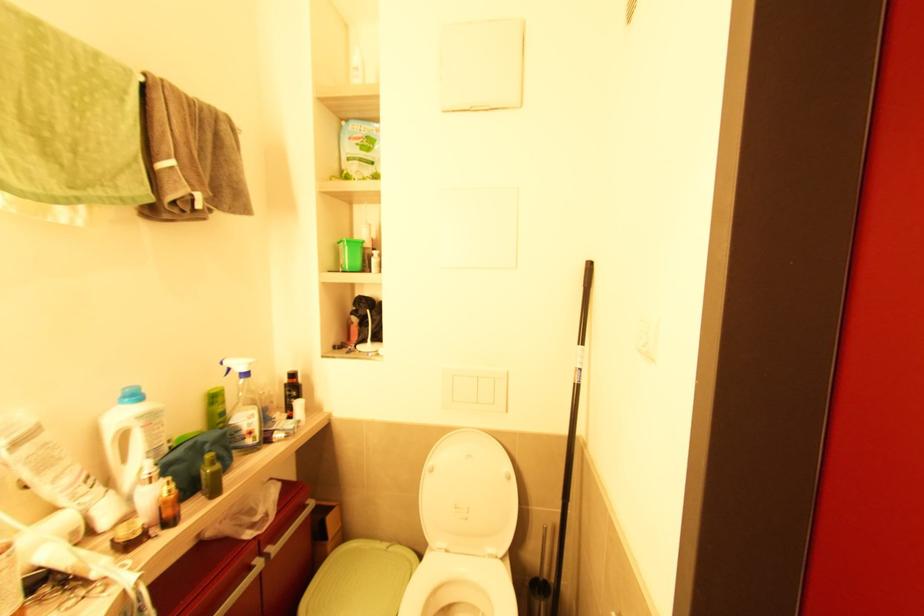
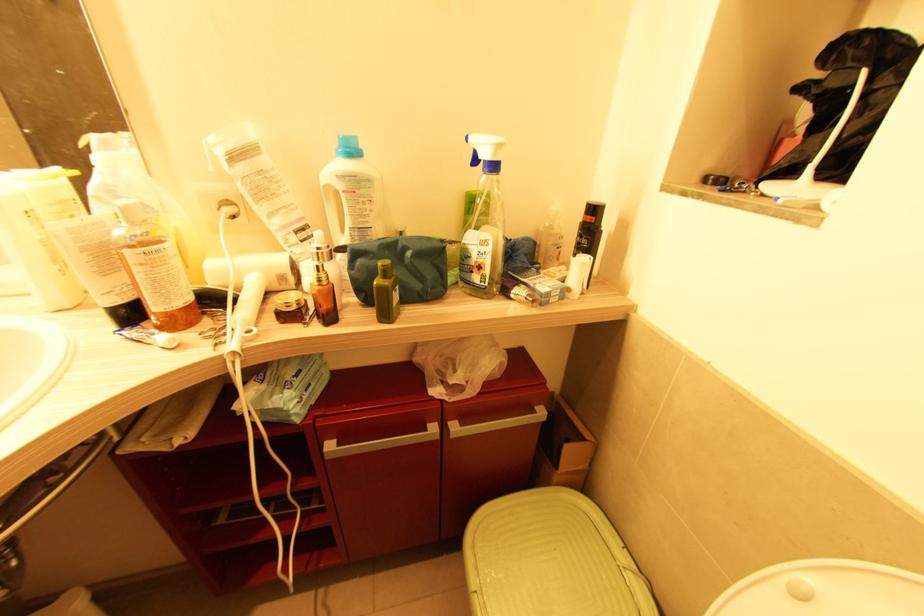
The point at (214,464) is marked in the first image. Where is the corresponding point in the second image?

(386, 278)